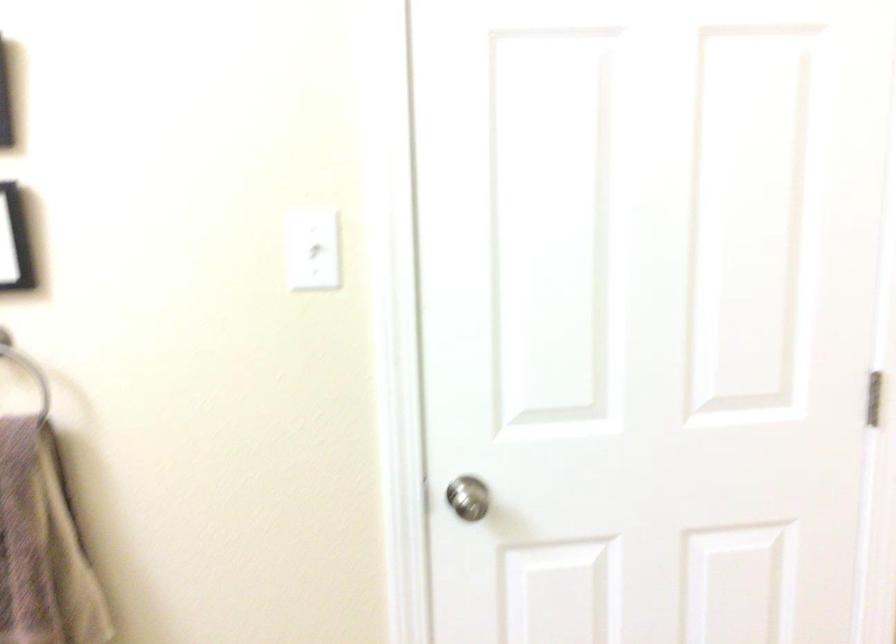
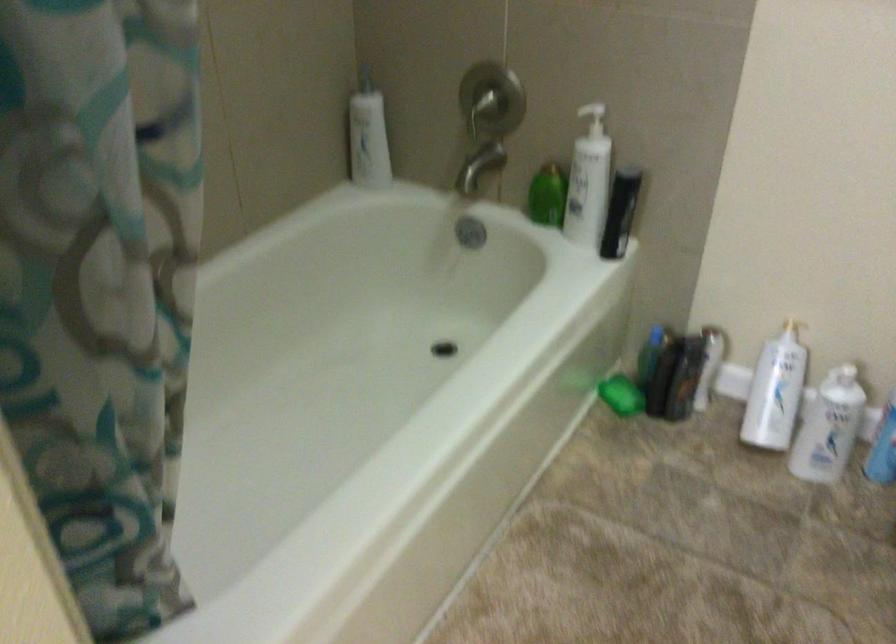
Based on the continuous images, in which direction is the camera rotating?

The rotation direction of the camera is right-down.